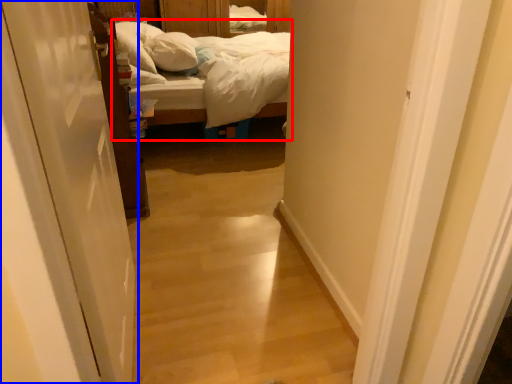
Question: Which point is further to the camera, bed (highlighted by a red box) or door (highlighted by a blue box)?

Choices:
 (A) bed
 (B) door

Answer: (A)